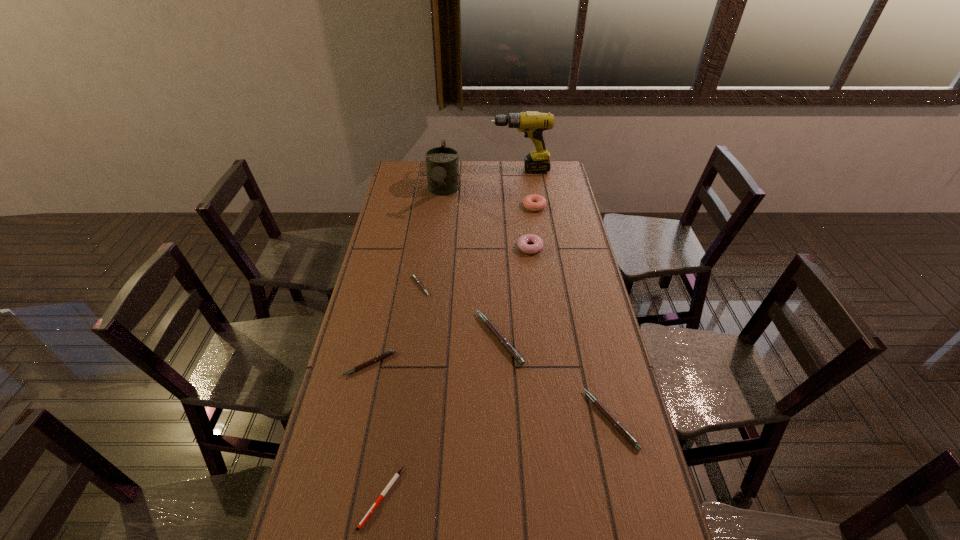
Find the location of a particular element. The image size is (960, 540). drill at the far edge is located at coordinates (532, 123).

Where is `watering can at the far edge`? watering can at the far edge is located at coordinates (442, 163).

I want to click on drill at the right edge, so point(532,123).

Where is `doughnut at the right edge`? doughnut at the right edge is located at coordinates (533, 202).

Image resolution: width=960 pixels, height=540 pixels. In order to click on pen at the right edge in this screenshot , I will do pyautogui.click(x=602, y=409).

Find the location of a particular element. Image resolution: width=960 pixels, height=540 pixels. object that is at the far right corner is located at coordinates (532, 123).

Find the location of `vacant space at the far edge`. vacant space at the far edge is located at coordinates (475, 168).

The height and width of the screenshot is (540, 960). Find the location of `vacant space at the left edge of the desktop`. vacant space at the left edge of the desktop is located at coordinates pyautogui.click(x=338, y=509).

The width and height of the screenshot is (960, 540). I want to click on vacant space at the right edge of the desktop, so click(x=587, y=312).

In the image, there is a desktop. At what (x,y) coordinates should I click in order to perform the action: click on free space at the far left corner. Please return your answer as a coordinate pair (x, y). Looking at the image, I should click on (395, 174).